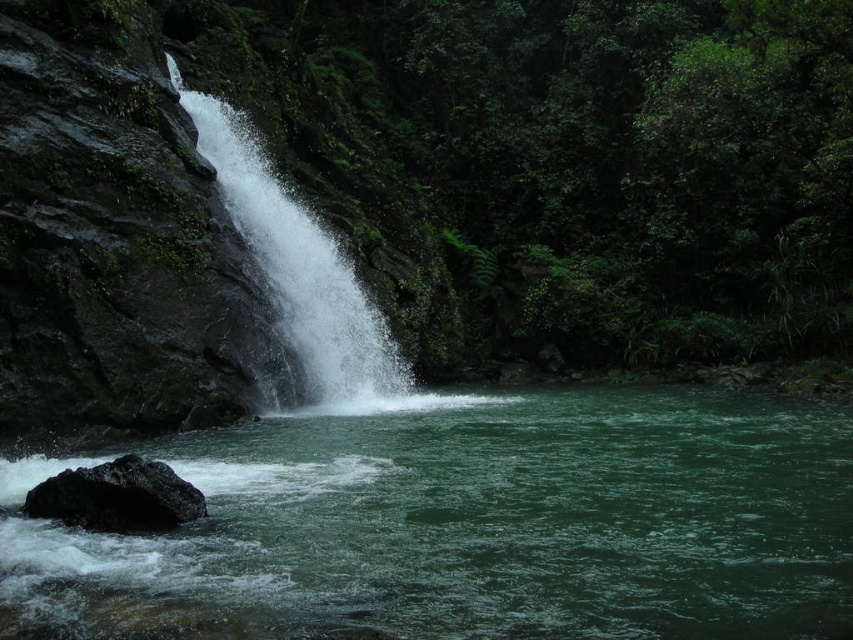
Does white frothy water at center have a greater height compared to black rough rock at lower left?

Indeed, white frothy water at center has a greater height compared to black rough rock at lower left.

Can you confirm if white frothy water at center is positioned above black rough rock at lower left?

Yes.

Which is in front, point (374, 401) or point (126, 499)?

Positioned in front is point (126, 499).

Image resolution: width=853 pixels, height=640 pixels. I want to click on white frothy water at center, so click(x=300, y=273).

Does green liquid at center appear over black rough rock at lower left?

No, green liquid at center is not above black rough rock at lower left.

Does point (357, 424) come behind point (67, 522)?

Yes, point (357, 424) is behind point (67, 522).

Which is in front, point (764, 621) or point (128, 465)?

Point (764, 621)

The height and width of the screenshot is (640, 853). Find the location of `green liquid at center`. green liquid at center is located at coordinates (471, 524).

Based on the photo, who is more distant from viewer, (380, 518) or (221, 138)?

The point (221, 138) is behind.

Can you confirm if green liquid at center is bigger than white frothy water at center?

Actually, green liquid at center might be smaller than white frothy water at center.

Find the location of a particular element. green liquid at center is located at coordinates (471, 524).